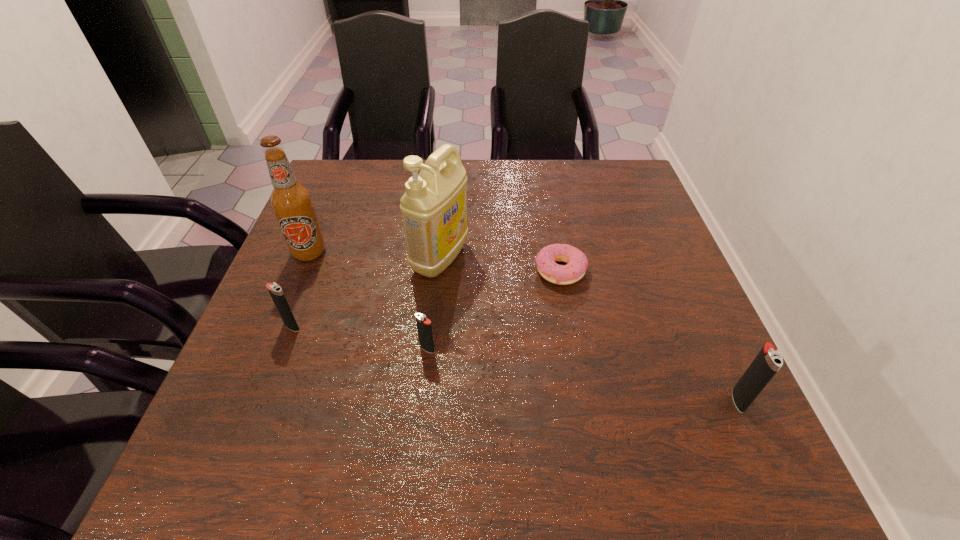
To achieve even spacing by inserting another igniter among them, please point to a vacant spot for this new igniter. Please provide its 2D coordinates. Your answer should be formatted as a tuple, i.e. [(x, y)], where the tuple contains the x and y coordinates of a point satisfying the conditions above.

[(575, 373)]